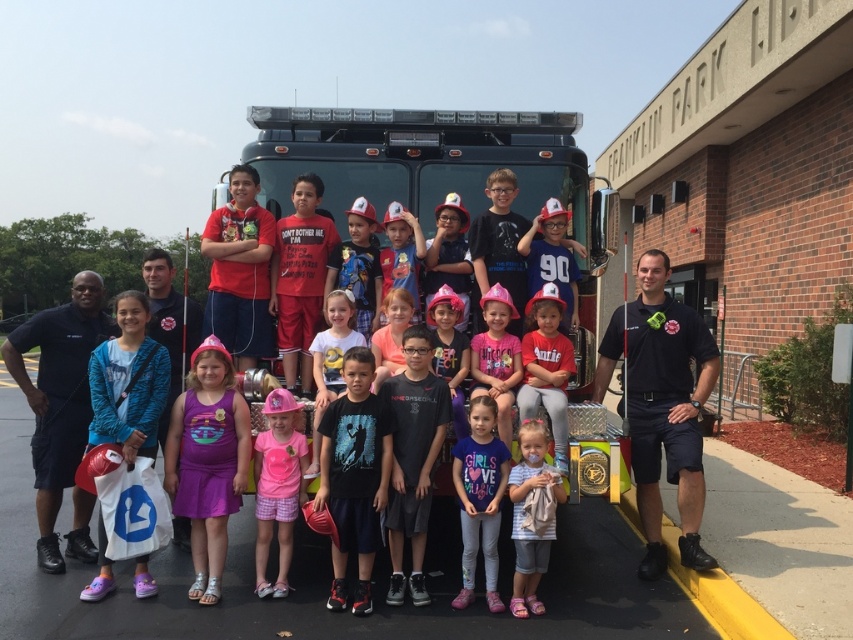
You are a photographer trying to capture a clear shot of the pink matte shirt at center and the pink fabric hat at center. Which object should you focus on first if you want to ensure the thinner one is in focus?

The pink matte shirt at center is thinner than the pink fabric hat at center, so you should focus on the pink matte shirt at center first to ensure it is in focus.